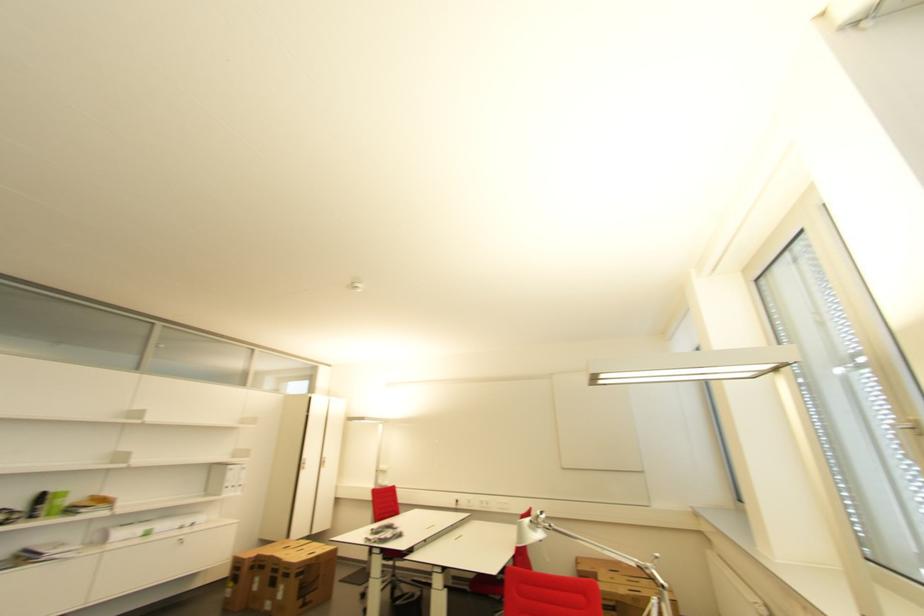
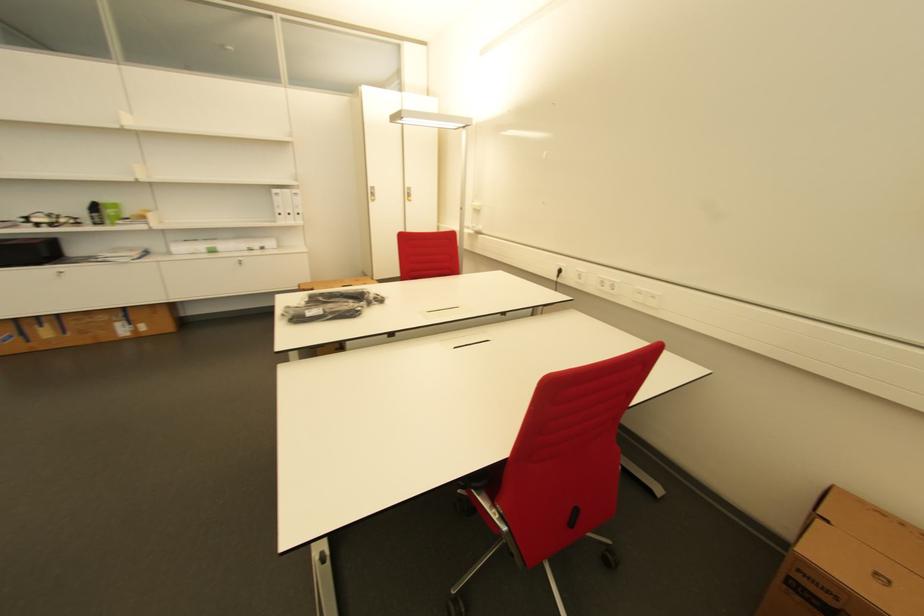
In the second image, find the point that corresponds to (x=49, y=499) in the first image.

(100, 209)